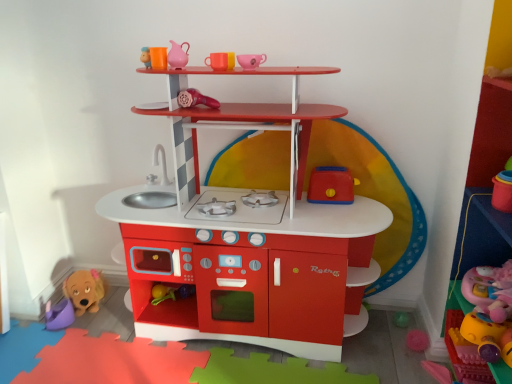
Where is `pink matte cup at upper center, acting as the sixth toy starting from the left`? The height and width of the screenshot is (384, 512). pink matte cup at upper center, acting as the sixth toy starting from the left is located at coordinates (251, 60).

Describe the element at coordinates (251, 60) in the screenshot. I see `pink matte cup at upper center, the third toy from the right` at that location.

Image resolution: width=512 pixels, height=384 pixels. I want to click on rubberized plastic microphone at center, arranged as the 6th toy when viewed from the right, so click(195, 99).

The width and height of the screenshot is (512, 384). What do you see at coordinates (221, 61) in the screenshot?
I see `matte ceramic cup at upper center, marked as the fifth toy in a right-to-left arrangement` at bounding box center [221, 61].

Looking at this image, what is the approximate height of purple plastic bucket at lower left, acting as the 8th toy starting from the right?

3.56 inches.

The width and height of the screenshot is (512, 384). Describe the element at coordinates (59, 314) in the screenshot. I see `purple plastic bucket at lower left, the 1th toy when ordered from left to right` at that location.

Identify the location of matte plastic play kitchen at center, the 4th toy positioned from the right. This screenshot has width=512, height=384. (246, 235).

Between point (233, 274) and point (492, 276), which one is positioned in front?

Positioned in front is point (492, 276).

Is matte plastic play kitchen at center, the fifth toy when ordered from left to right, facing away from soft pink plush at lower right, positioned as the first toy in right-to-left order?

matte plastic play kitchen at center, the fifth toy when ordered from left to right, is not turned away from soft pink plush at lower right, positioned as the first toy in right-to-left order.

You are a GUI agent. You are given a task and a screenshot of the screen. Output one action in this format:
    pyautogui.click(x=<x>, y=<y>)
    Task: Click on the 1st toy directly above the soft pink plush at lower right, positioned as the first toy in right-to-left order (from a real-world perspective)
    
    Given the screenshot: What is the action you would take?
    pyautogui.click(x=246, y=235)

Considering the sizes of matte plastic play kitchen at center, the 4th toy positioned from the right, and soft pink plush at lower right, positioned as the first toy in right-to-left order, in the image, is matte plastic play kitchen at center, the 4th toy positioned from the right, wider or thinner than soft pink plush at lower right, positioned as the first toy in right-to-left order,?

Clearly, matte plastic play kitchen at center, the 4th toy positioned from the right, has more width compared to soft pink plush at lower right, positioned as the first toy in right-to-left order.

Which of these two, matte plastic play kitchen at center, the fifth toy when ordered from left to right, or matte ceramic cup at upper center, marked as the fifth toy in a right-to-left arrangement, is smaller?

matte ceramic cup at upper center, marked as the fifth toy in a right-to-left arrangement.

Is matte plastic play kitchen at center, the 4th toy positioned from the right, oriented towards matte ceramic cup at upper center, which is counted as the fourth toy, starting from the left?

No, matte plastic play kitchen at center, the 4th toy positioned from the right, is not turned towards matte ceramic cup at upper center, which is counted as the fourth toy, starting from the left.

Considering the sizes of matte plastic play kitchen at center, the fifth toy when ordered from left to right, and matte ceramic cup at upper center, which is counted as the fourth toy, starting from the left, in the image, is matte plastic play kitchen at center, the fifth toy when ordered from left to right, wider or thinner than matte ceramic cup at upper center, which is counted as the fourth toy, starting from the left,?

matte plastic play kitchen at center, the fifth toy when ordered from left to right, is wider than matte ceramic cup at upper center, which is counted as the fourth toy, starting from the left.

From a real-world perspective, which object stands above the other?

matte ceramic cup at upper center, which is counted as the fourth toy, starting from the left, is physically above.

Between pink matte cup at upper center, the third toy from the right, and rubberized plastic toaster at center-right, placed as the 7th toy when sorted from left to right, which one has larger width?

With larger width is rubberized plastic toaster at center-right, placed as the 7th toy when sorted from left to right.

Is point (262, 61) positioned behind point (325, 177)?

That is False.

From the image's perspective, is pink matte cup at upper center, acting as the sixth toy starting from the left, above rubberized plastic toaster at center-right, placed as the 7th toy when sorted from left to right?

Yes.

From the image's perspective, which is below, matte ceramic cup at upper center, which is counted as the fourth toy, starting from the left, or rubberized plastic toaster at center-right, which is the 2th toy from right to left?

rubberized plastic toaster at center-right, which is the 2th toy from right to left.

How far apart are matte ceramic cup at upper center, marked as the fifth toy in a right-to-left arrangement, and rubberized plastic toaster at center-right, which is the 2th toy from right to left?

A distance of 52.14 centimeters exists between matte ceramic cup at upper center, marked as the fifth toy in a right-to-left arrangement, and rubberized plastic toaster at center-right, which is the 2th toy from right to left.

Does matte ceramic cup at upper center, marked as the fifth toy in a right-to-left arrangement, appear on the right side of rubberized plastic toaster at center-right, which is the 2th toy from right to left?

Incorrect, matte ceramic cup at upper center, marked as the fifth toy in a right-to-left arrangement, is not on the right side of rubberized plastic toaster at center-right, which is the 2th toy from right to left.

Is matte ceramic cup at upper center, which is counted as the fourth toy, starting from the left, oriented towards rubberized plastic toaster at center-right, placed as the 7th toy when sorted from left to right?

No, matte ceramic cup at upper center, which is counted as the fourth toy, starting from the left, is not aimed at rubberized plastic toaster at center-right, placed as the 7th toy when sorted from left to right.

From a real-world perspective, between soft pink plush at lower right, positioned as the first toy in right-to-left order, and rubberized plastic toaster at center-right, placed as the 7th toy when sorted from left to right, who is vertically higher?

rubberized plastic toaster at center-right, placed as the 7th toy when sorted from left to right, is physically above.

Does soft pink plush at lower right, the eighth toy viewed from the left, come in front of rubberized plastic toaster at center-right, which is the 2th toy from right to left?

Yes, soft pink plush at lower right, the eighth toy viewed from the left, is closer to the viewer.

Considering the sizes of objects soft pink plush at lower right, the eighth toy viewed from the left, and rubberized plastic toaster at center-right, placed as the 7th toy when sorted from left to right, in the image provided, who is thinner, soft pink plush at lower right, the eighth toy viewed from the left, or rubberized plastic toaster at center-right, placed as the 7th toy when sorted from left to right,?

rubberized plastic toaster at center-right, placed as the 7th toy when sorted from left to right, is thinner.

From the image's perspective, is soft pink plush at lower right, the eighth toy viewed from the left, located beneath rubberized plastic toaster at center-right, which is the 2th toy from right to left?

Yes.

From the picture: Can you confirm if matte pink pitcher at upper center, the 7th toy in the right-to-left sequence, is thinner than matte ceramic cup at upper center, marked as the fifth toy in a right-to-left arrangement?

Yes.

Based on the photo, is matte pink pitcher at upper center, the 7th toy in the right-to-left sequence, positioned far away from matte ceramic cup at upper center, which is counted as the fourth toy, starting from the left?

matte pink pitcher at upper center, the 7th toy in the right-to-left sequence, is near matte ceramic cup at upper center, which is counted as the fourth toy, starting from the left, not far away.

Is matte pink pitcher at upper center, the 7th toy in the right-to-left sequence, aimed at matte ceramic cup at upper center, marked as the fifth toy in a right-to-left arrangement?

No, matte pink pitcher at upper center, the 7th toy in the right-to-left sequence, is not facing towards matte ceramic cup at upper center, marked as the fifth toy in a right-to-left arrangement.

Considering the sizes of objects matte pink pitcher at upper center, the 2th toy viewed from the left, and matte ceramic cup at upper center, marked as the fifth toy in a right-to-left arrangement, in the image provided, who is smaller, matte pink pitcher at upper center, the 2th toy viewed from the left, or matte ceramic cup at upper center, marked as the fifth toy in a right-to-left arrangement,?

With smaller size is matte pink pitcher at upper center, the 2th toy viewed from the left.

Is soft pink plush at lower right, positioned as the first toy in right-to-left order, not near purple plastic bucket at lower left, the 1th toy when ordered from left to right?

Yes, soft pink plush at lower right, positioned as the first toy in right-to-left order, and purple plastic bucket at lower left, the 1th toy when ordered from left to right, are quite far apart.

Which object is thinner, soft pink plush at lower right, positioned as the first toy in right-to-left order, or purple plastic bucket at lower left, the 1th toy when ordered from left to right?

purple plastic bucket at lower left, the 1th toy when ordered from left to right, is thinner.

Where is `toy lying below the soft pink plush at lower right, the eighth toy viewed from the left (from the image's perspective)`? This screenshot has height=384, width=512. toy lying below the soft pink plush at lower right, the eighth toy viewed from the left (from the image's perspective) is located at coordinates (x=59, y=314).

Is soft pink plush at lower right, positioned as the first toy in right-to-left order, inside the boundaries of purple plastic bucket at lower left, the 1th toy when ordered from left to right, or outside?

soft pink plush at lower right, positioned as the first toy in right-to-left order, is not inside purple plastic bucket at lower left, the 1th toy when ordered from left to right, it's outside.

Where is `toy that is the 1st one below the matte plastic play kitchen at center, the fifth toy when ordered from left to right (from a real-world perspective)`? toy that is the 1st one below the matte plastic play kitchen at center, the fifth toy when ordered from left to right (from a real-world perspective) is located at coordinates (482, 316).

From the image's perspective, which toy is the 4th one below the matte ceramic cup at upper center, marked as the fifth toy in a right-to-left arrangement? Please provide its 2D coordinates.

[(246, 235)]

Considering their positions, is rubberized plastic toaster at center-right, which is the 2th toy from right to left, positioned closer to matte pink pitcher at upper center, the 2th toy viewed from the left, than purple plastic bucket at lower left, the 1th toy when ordered from left to right?

rubberized plastic toaster at center-right, which is the 2th toy from right to left, is closer to matte pink pitcher at upper center, the 2th toy viewed from the left.

From the image, which object appears to be nearer to rubberized plastic toaster at center-right, which is the 2th toy from right to left, soft pink plush at lower right, positioned as the first toy in right-to-left order, or purple plastic bucket at lower left, the 1th toy when ordered from left to right?

Based on the image, soft pink plush at lower right, positioned as the first toy in right-to-left order, appears to be nearer to rubberized plastic toaster at center-right, which is the 2th toy from right to left.

From the image, which object appears to be nearer to soft pink plush at lower right, positioned as the first toy in right-to-left order, matte ceramic cup at upper center, which is counted as the fourth toy, starting from the left, or purple plastic bucket at lower left, acting as the 8th toy starting from the right?

matte ceramic cup at upper center, which is counted as the fourth toy, starting from the left.

Considering their positions, is soft pink plush at lower right, positioned as the first toy in right-to-left order, positioned further to matte ceramic cup at upper center, which is counted as the fourth toy, starting from the left, than pink matte cup at upper center, the third toy from the right?

soft pink plush at lower right, positioned as the first toy in right-to-left order, is further to matte ceramic cup at upper center, which is counted as the fourth toy, starting from the left.

When comparing their distances from soft pink plush at lower right, positioned as the first toy in right-to-left order, does purple plastic bucket at lower left, the 1th toy when ordered from left to right, or rubberized plastic toaster at center-right, placed as the 7th toy when sorted from left to right, seem further?

purple plastic bucket at lower left, the 1th toy when ordered from left to right.

Which object lies further to the anchor point soft pink plush at lower right, positioned as the first toy in right-to-left order, pink matte cup at upper center, the third toy from the right, or rubberized plastic toaster at center-right, placed as the 7th toy when sorted from left to right?

pink matte cup at upper center, the third toy from the right.

From the image, which object appears to be nearer to matte pink pitcher at upper center, the 7th toy in the right-to-left sequence, matte ceramic cup at upper center, which is counted as the fourth toy, starting from the left, or rubberized plastic microphone at center, arranged as the 6th toy when viewed from the right?

rubberized plastic microphone at center, arranged as the 6th toy when viewed from the right.

Based on their spatial positions, is purple plastic bucket at lower left, the 1th toy when ordered from left to right, or matte pink pitcher at upper center, the 7th toy in the right-to-left sequence, closer to matte ceramic cup at upper center, which is counted as the fourth toy, starting from the left?

The object closer to matte ceramic cup at upper center, which is counted as the fourth toy, starting from the left, is matte pink pitcher at upper center, the 7th toy in the right-to-left sequence.